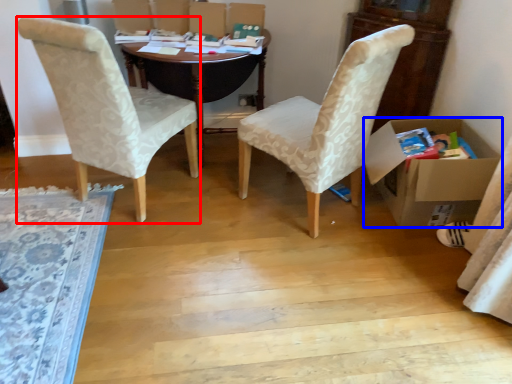
Question: Which point is closer to the camera, chair (highlighted by a red box) or box (highlighted by a blue box)?

Choices:
 (A) chair
 (B) box

Answer: (A)